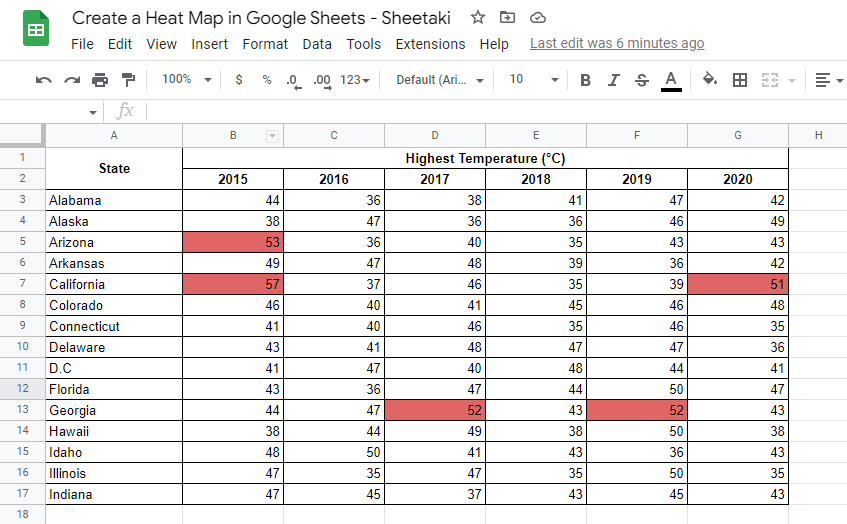
Where is `boxes with color`? This screenshot has height=524, width=847. boxes with color is located at coordinates (37, 34), (237, 243), (234, 285), (432, 414), (644, 410), (744, 282).